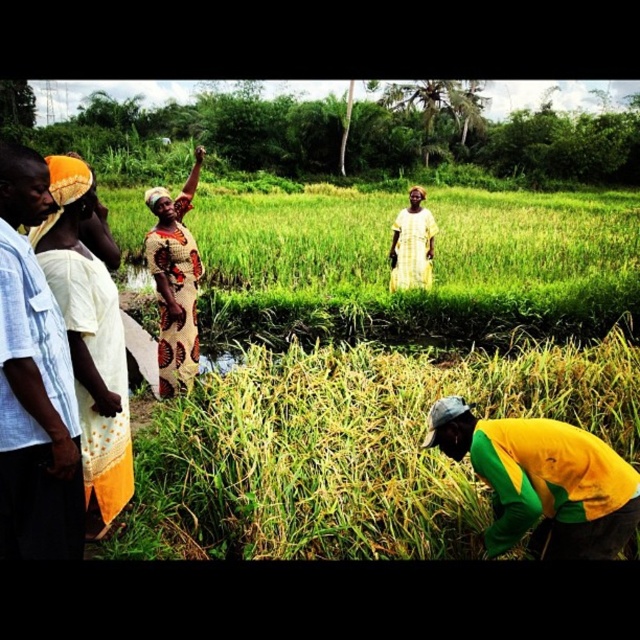
Can you confirm if light blue cotton shirt at left is positioned below yellow woven cloth at left?

Yes.

Between point (28, 172) and point (60, 305), which one is positioned in front?

Point (28, 172)

Between point (58, 481) and point (49, 257), which one is positioned in front?

Positioned in front is point (58, 481).

Locate an element on the screen. light blue cotton shirt at left is located at coordinates (33, 381).

Who is positioned more to the right, light blue cotton shirt at left or printed fabric dress at center?

Positioned to the right is light blue cotton shirt at left.

Is point (10, 497) in front of point (157, 188)?

That is True.

Is point (19, 148) positioned in front of point (170, 234)?

Yes, it is in front of point (170, 234).

Identify the location of light blue cotton shirt at left. The height and width of the screenshot is (640, 640). (33, 381).

Does yellow-green grass at lower center have a greater width compared to yellow printed dress at center?

Correct, the width of yellow-green grass at lower center exceeds that of yellow printed dress at center.

Between yellow-green grass at lower center and yellow printed dress at center, which one is positioned higher?

Positioned higher is yellow printed dress at center.

This screenshot has height=640, width=640. I want to click on yellow-green grass at lower center, so click(349, 449).

Where is `yellow-green grass at lower center`? yellow-green grass at lower center is located at coordinates (349, 449).